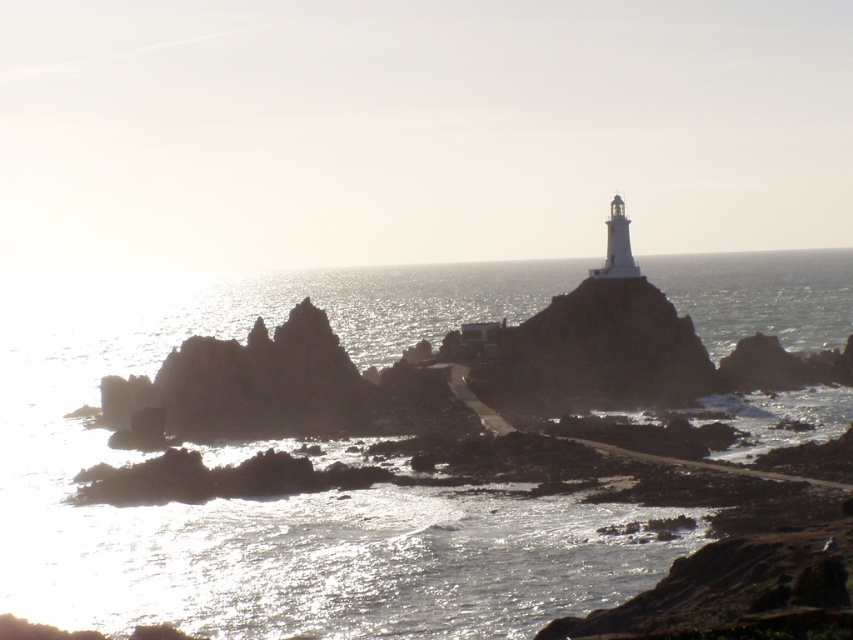
You are a hiker carrying a heavy backpack and need to cross from the dark gray rocky outcrop at center to the glistening silver water at center. Based on the scene, which path would be safer for your heavy load?

The dark gray rocky outcrop at center has rugged and uneven terrain with jagged edges and wet rocks, making it more dangerous. The glistening silver water at center is wider and smoother, so crossing there would be safer for your heavy load.

You are a hiker who wants to reach the lighthouse at the top of the dark gray rocky outcrop at center. You notice the glistening silver water at center nearby. Which direction should you move relative to the water to avoid getting wet?

The glistening silver water at center is positioned over dark gray rocky outcrop at center, so to avoid getting wet, you should move away from the glistening silver water at center towards the rocky outcrop at center.